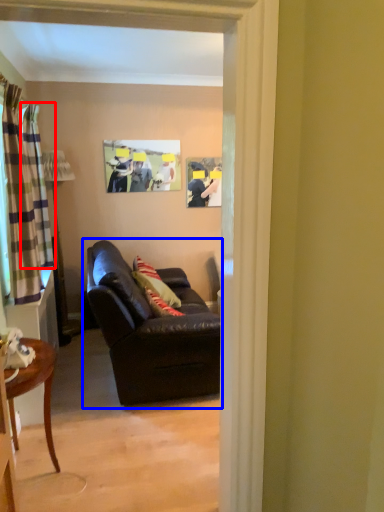
Question: Which object appears closest to the camera in this image, curtain (highlighted by a red box) or studio couch (highlighted by a blue box)?

Choices:
 (A) curtain
 (B) studio couch

Answer: (B)